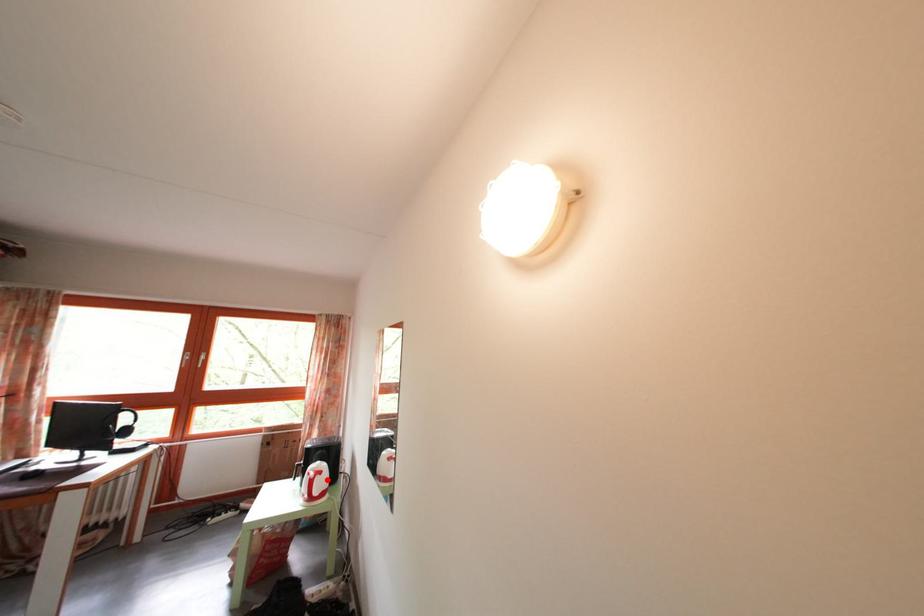
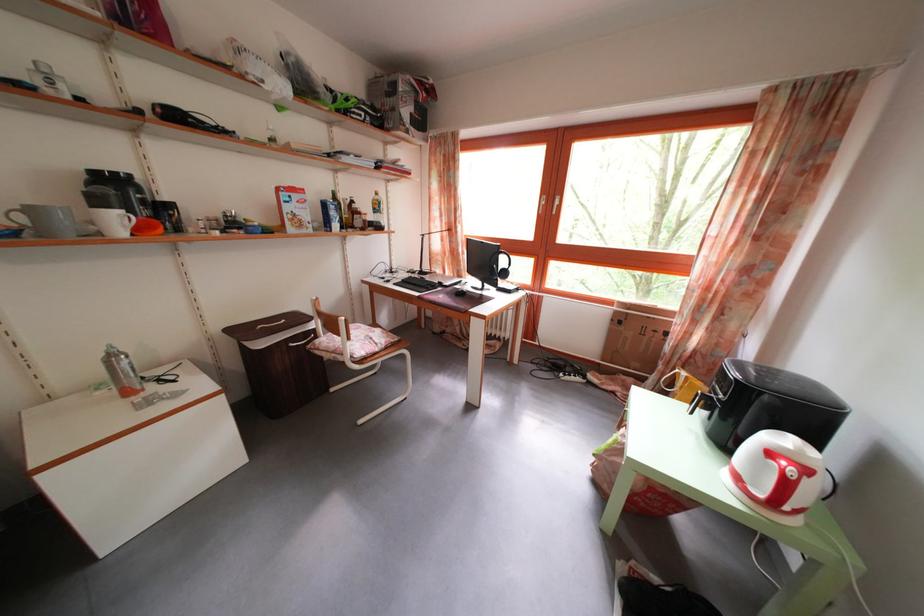
Where in the second image is the point corresponding to the highlighted location from the first image?

(812, 477)